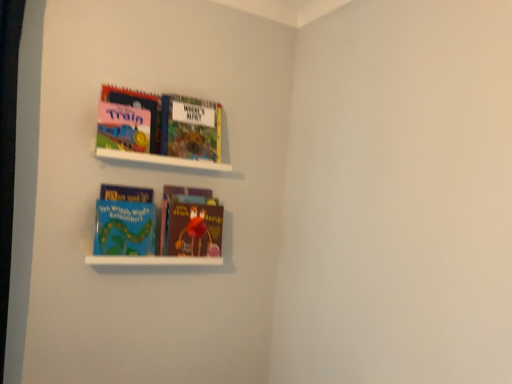
Find the location of `free point above white matte shelf at lower center, positioned as the second cabinet in top-to-bottom order (from a real-world perspective)`. free point above white matte shelf at lower center, positioned as the second cabinet in top-to-bottom order (from a real-world perspective) is located at coordinates (152, 248).